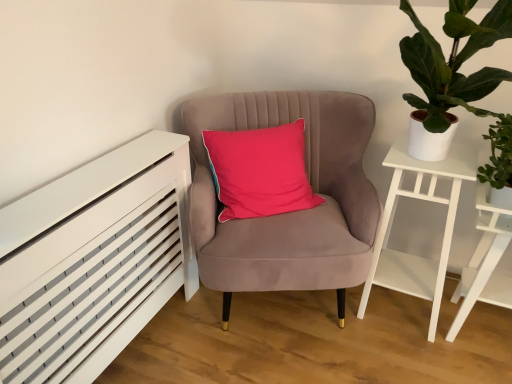
The image size is (512, 384). In order to click on vacant region below white wooden side table at right (from a real-world perspective) in this screenshot , I will do `click(480, 330)`.